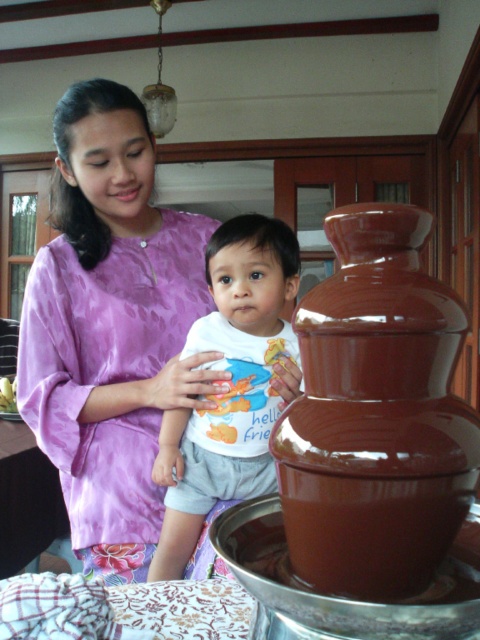
You are a photographer positioned at the entrance of the room. You want to capture a closeup shot of the purple satin dress at upper left and the white cotton shirt at center. What is the minimum distance you need to maintain between the camera and the subjects to ensure both are in focus?

The minimum distance required is 4.76 inches, as the purple satin dress at upper left is 4.76 inches away from the white cotton shirt at center. To ensure both are in focus, the camera should be positioned at least this distance away.

You are standing in the room and want to reach the point marked at coordinate point (367,353). If your arm can extend 14 inches, can you touch that point without moving closer?

The distance between you and point (367,353) is 14.78 inches. Since your arm can only reach 14 inches, you cannot touch the point without moving closer.

You are a photographer standing in the room. You want to take a photo of the shiny brown chocolate fountain at right without including the purple satin dress at upper left in the frame. Is it possible based on their positions?

The purple satin dress at upper left is positioned over the shiny brown chocolate fountain at right, so it would block the view of the chocolate fountain. Therefore, it is not possible to take a photo of the shiny brown chocolate fountain at right without including the purple satin dress at upper left in the frame.